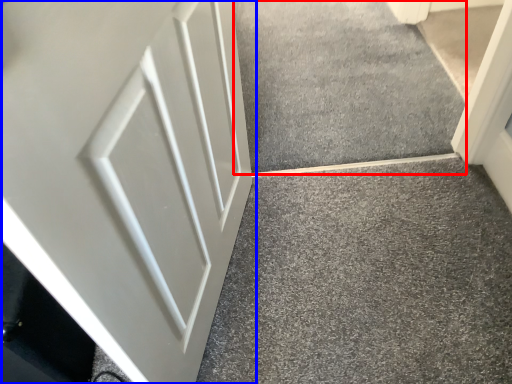
Question: Which object is closer to the camera taking this photo, concrete (highlighted by a red box) or door (highlighted by a blue box)?

Choices:
 (A) concrete
 (B) door

Answer: (B)